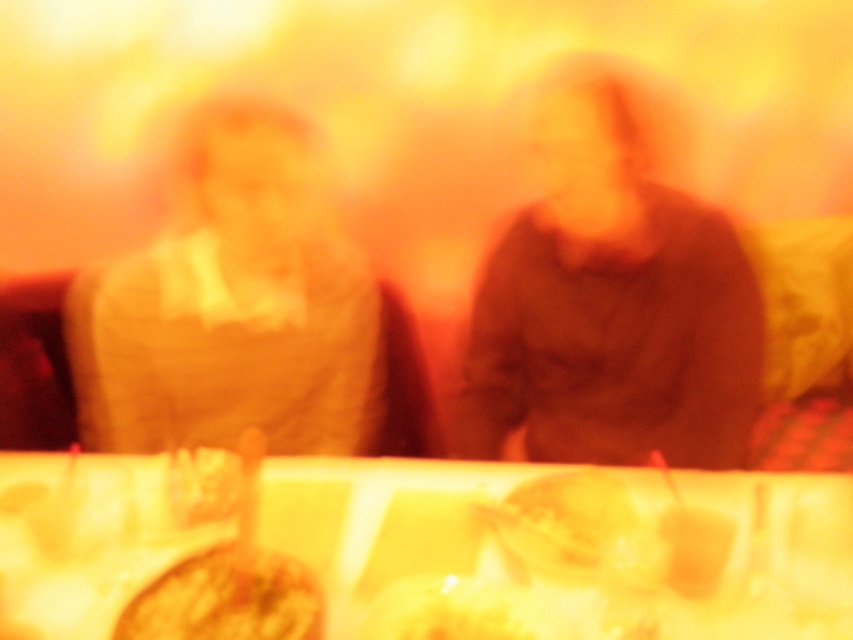
Between wooden table at center and matte beige sweater at left, which one appears on the left side from the viewer's perspective?

Positioned to the left is matte beige sweater at left.

Where is `wooden table at center`? This screenshot has height=640, width=853. wooden table at center is located at coordinates (416, 550).

Is the position of smooth yellow cake at lower center more distant than that of yellow matte plate at center?

No, it is not.

Where is `smooth yellow cake at lower center`? The width and height of the screenshot is (853, 640). smooth yellow cake at lower center is located at coordinates (227, 598).

What are the coordinates of `smooth yellow cake at lower center` in the screenshot? It's located at (227, 598).

Is wooden table at center positioned in front of smooth yellow cake at lower center?

No, it is behind smooth yellow cake at lower center.

Does wooden table at center have a smaller size compared to smooth yellow cake at lower center?

No, wooden table at center is not smaller than smooth yellow cake at lower center.

Which is in front, point (42, 522) or point (314, 579)?

Point (314, 579)

Locate an element on the screen. The image size is (853, 640). wooden table at center is located at coordinates (416, 550).